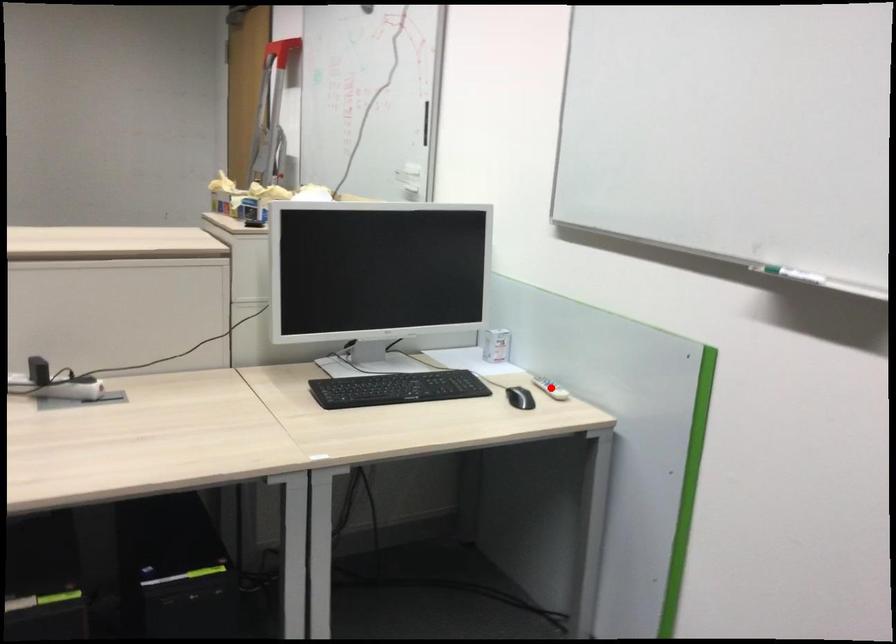
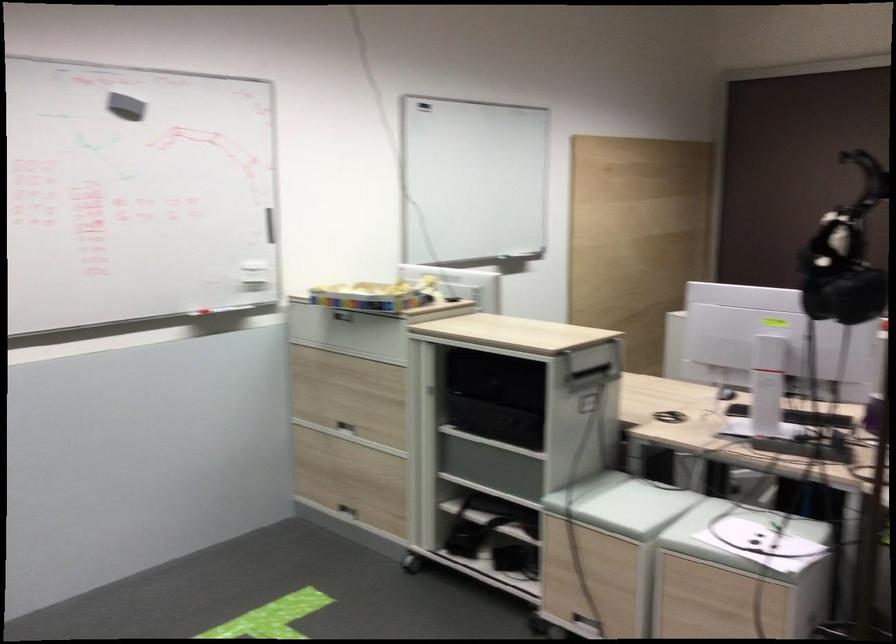
Question: I am providing you with two images of the same scene from different viewpoints. A red point is marked on the first image. Can you still see the location of the red point in image 2?

Choices:
 (A) Yes
 (B) No

Answer: (B)